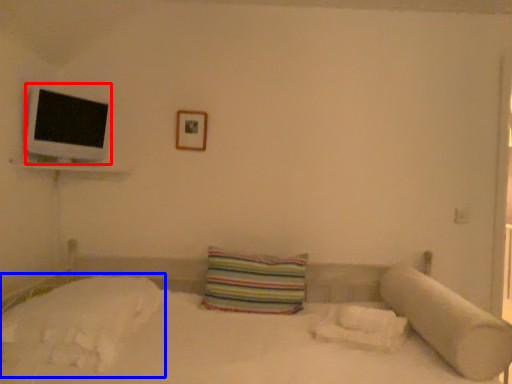
Question: Which object appears farthest to the camera in this image, flat (highlighted by a red box) or sheet (highlighted by a blue box)?

Choices:
 (A) flat
 (B) sheet

Answer: (A)